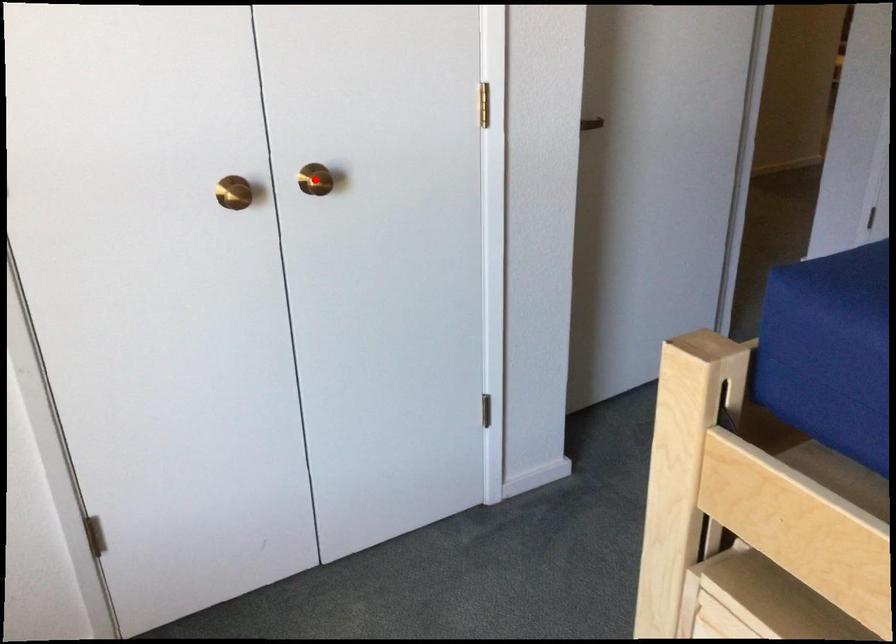
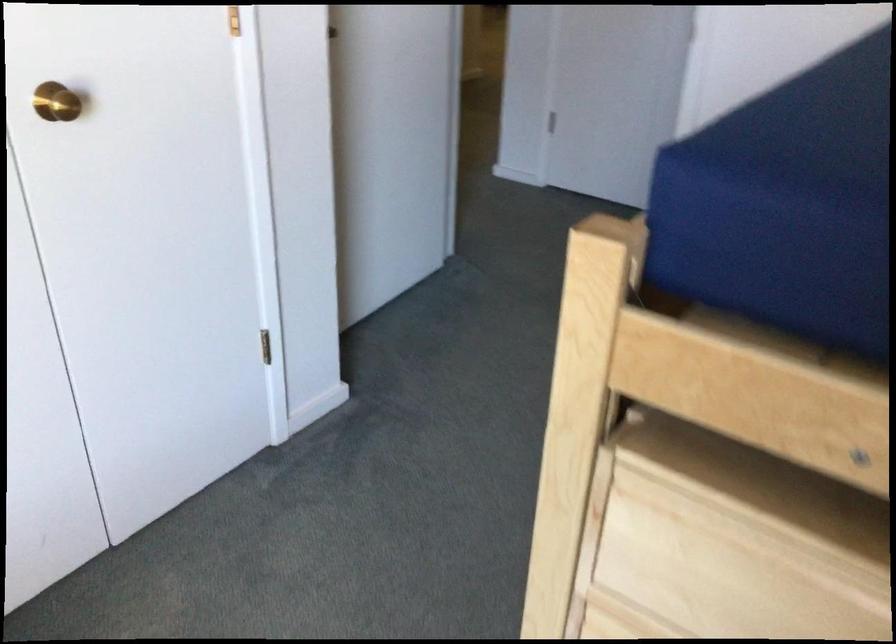
Question: A red point is marked in image1. In image2, is the corresponding 3D point closer to the camera or farther? Reply with the corresponding letter.

Choices:
 (A) The corresponding 3D point is closer.
 (B) The corresponding 3D point is farther.

Answer: (A)